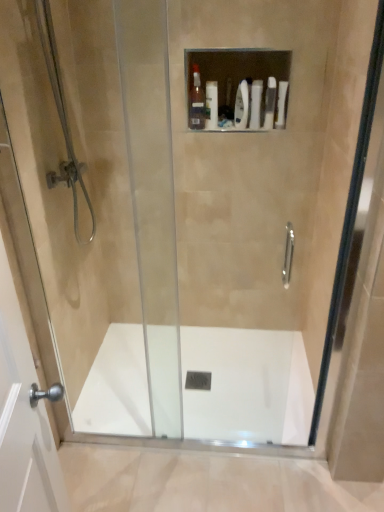
Image resolution: width=384 pixels, height=512 pixels. I want to click on vacant space in front of clear glass shower door at left, so click(x=119, y=478).